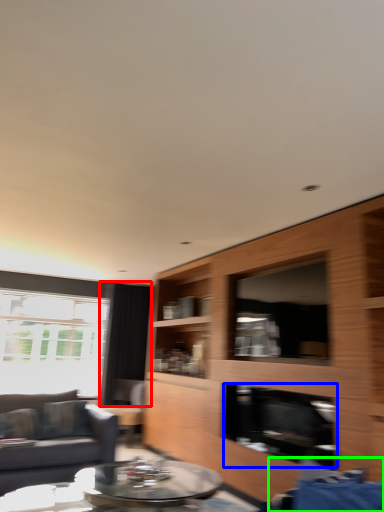
Question: Which object is the closest to the curtain (highlighted by a red box)? Choose among these: fireplace (highlighted by a blue box) or swivel chair (highlighted by a green box).

Choices:
 (A) fireplace
 (B) swivel chair

Answer: (A)